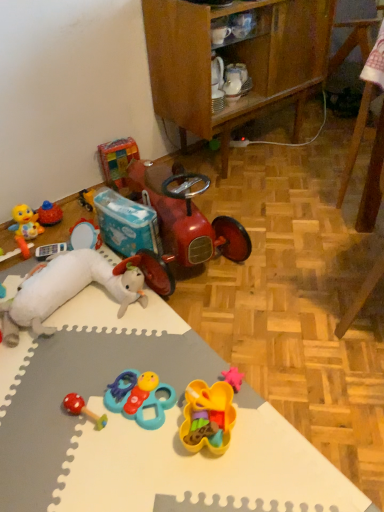
This screenshot has height=512, width=384. Find the location of `vacant space in front of white plush toy at lower left, which is the 4th toy in front-to-back order`. vacant space in front of white plush toy at lower left, which is the 4th toy in front-to-back order is located at coordinates (65, 392).